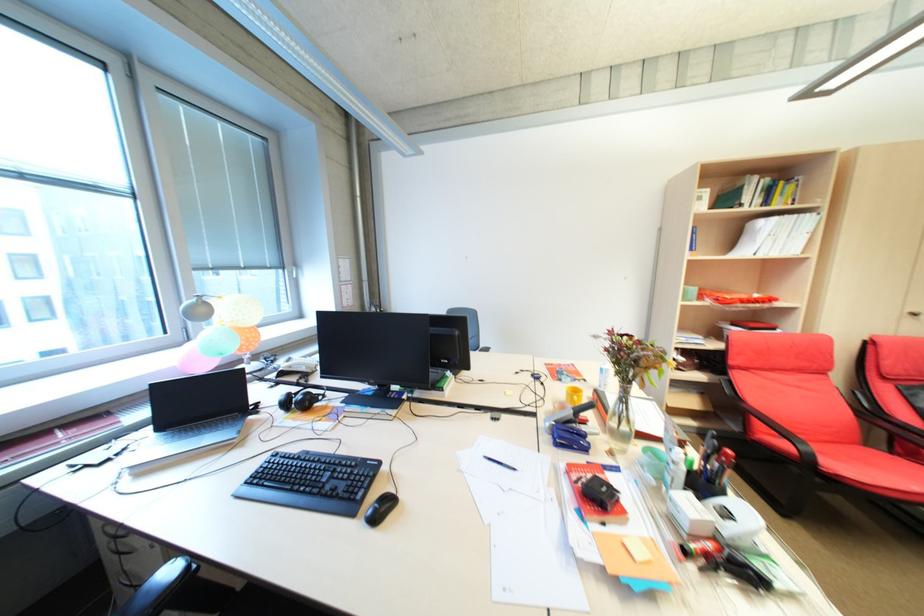
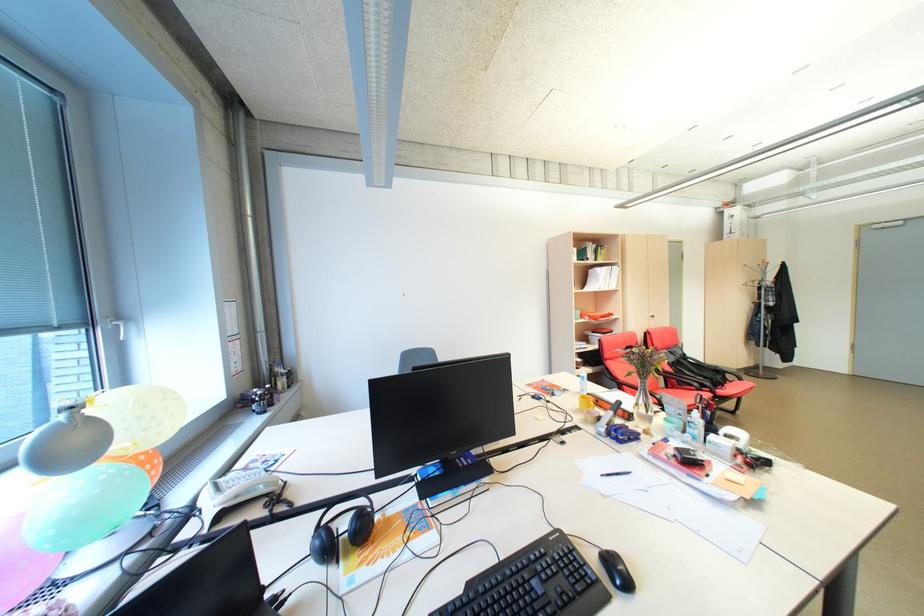
Find the pixel in the second image that matches point 379,514 in the first image.

(627, 582)